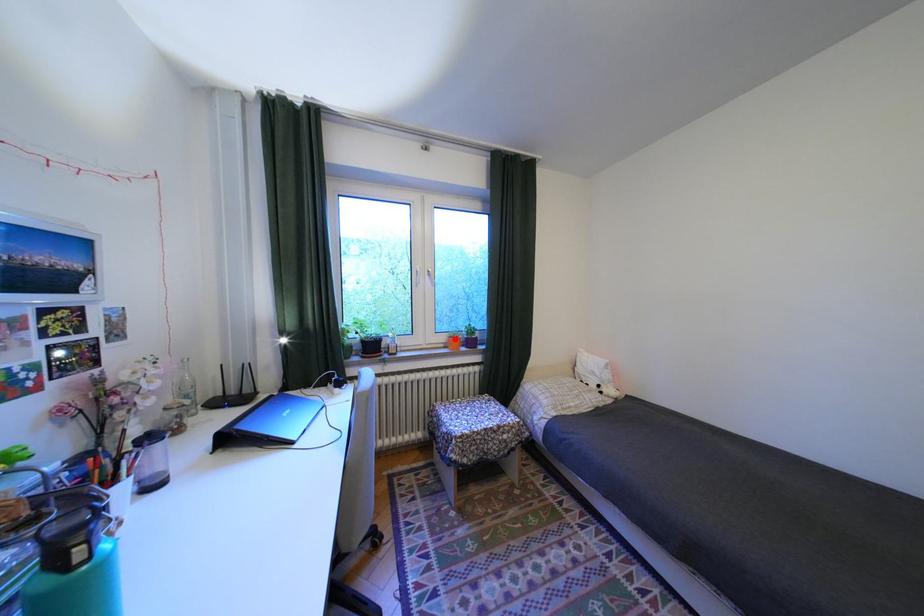
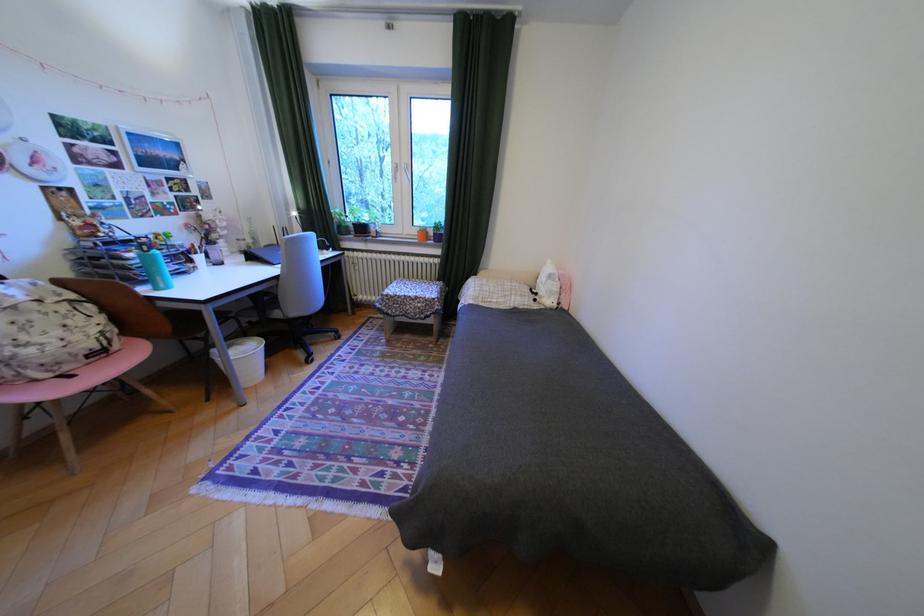
The point at the highlighted location is marked in the first image. Where is the corresponding point in the second image?

(427, 232)